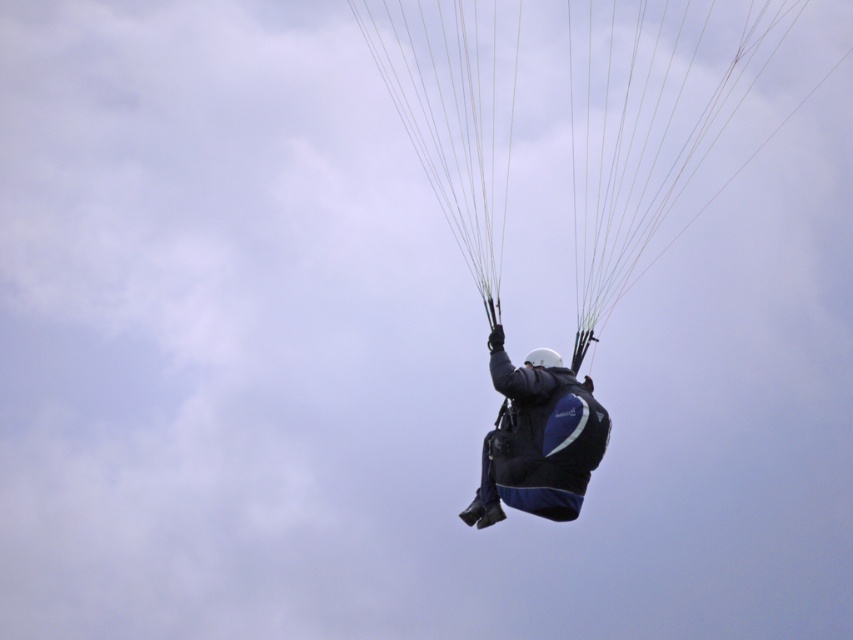
Question: Does blue fabric parachute at center appear on the left side of dark blue fabric parachute at center?

Choices:
 (A) no
 (B) yes

Answer: (A)

Question: Can you confirm if blue fabric parachute at center is bigger than dark blue fabric parachute at center?

Choices:
 (A) yes
 (B) no

Answer: (A)

Question: Which point is farther from the camera taking this photo?

Choices:
 (A) (508, 467)
 (B) (682, 33)

Answer: (B)

Question: Which object appears farthest from the camera in this image?

Choices:
 (A) blue fabric parachute at center
 (B) dark blue fabric parachute at center

Answer: (A)

Question: Can you confirm if blue fabric parachute at center is bigger than dark blue fabric parachute at center?

Choices:
 (A) no
 (B) yes

Answer: (B)